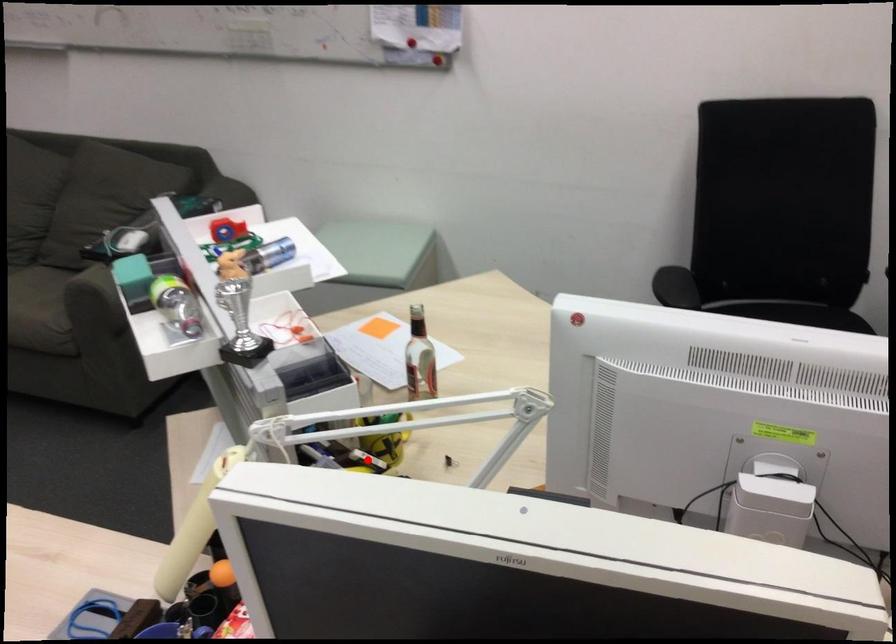
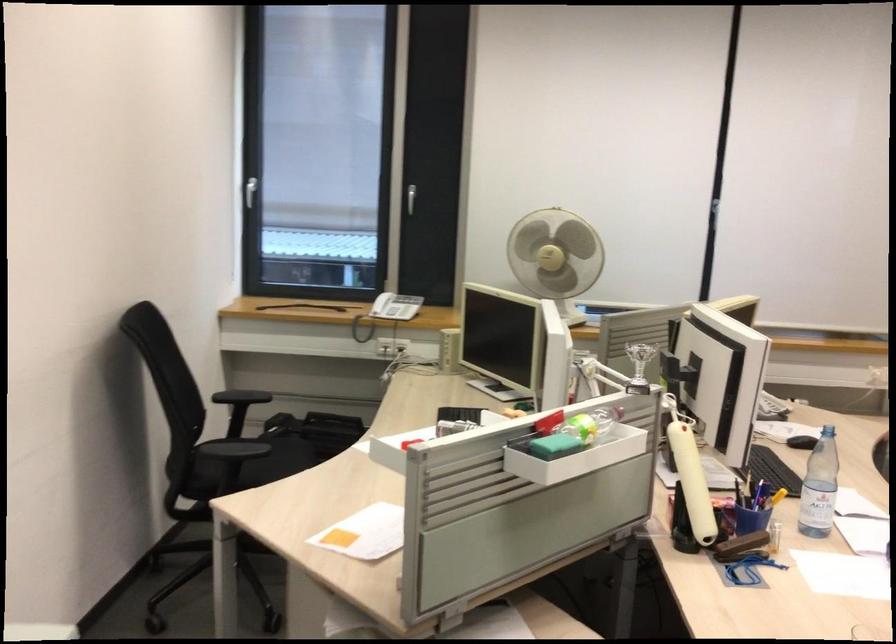
Question: I am providing you with two images of the same scene from different viewpoints. A red point is marked on the first image. Is the red point's position out of view in image 2?

Choices:
 (A) Yes
 (B) No

Answer: (A)